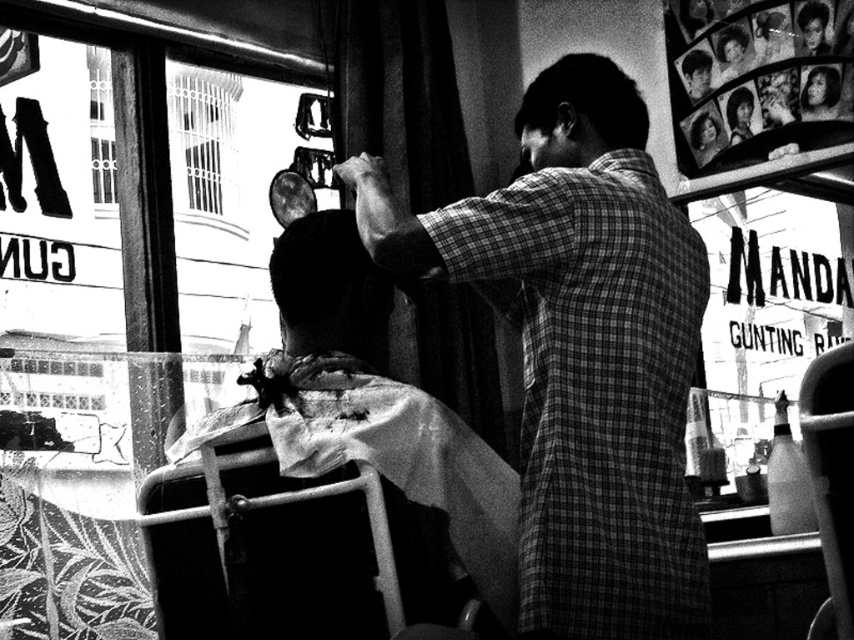
Question: Which object is farther from the camera taking this photo?

Choices:
 (A) short hair at upper center
 (B) metallic white chair at center

Answer: (A)

Question: Can you confirm if metallic silver chair at lower center is positioned to the left of short hair at upper center?

Choices:
 (A) no
 (B) yes

Answer: (B)

Question: Which object appears farthest from the camera in this image?

Choices:
 (A) checkered fabric shirt at center
 (B) short hair at upper center

Answer: (B)

Question: Which of these objects is positioned closest to the checkered fabric shirt at center?

Choices:
 (A) metallic silver chair at lower center
 (B) short hair at center
 (C) short hair at upper center
 (D) metallic white chair at center

Answer: (C)

Question: Is checkered fabric shirt at center thinner than short hair at upper center?

Choices:
 (A) no
 (B) yes

Answer: (A)

Question: Can you confirm if short hair at center is bigger than short hair at upper center?

Choices:
 (A) no
 (B) yes

Answer: (B)